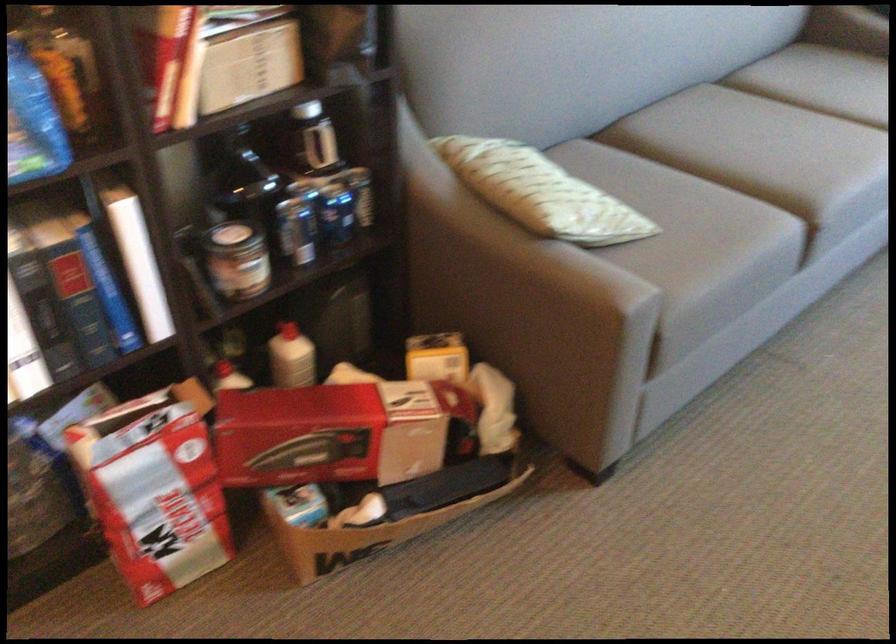
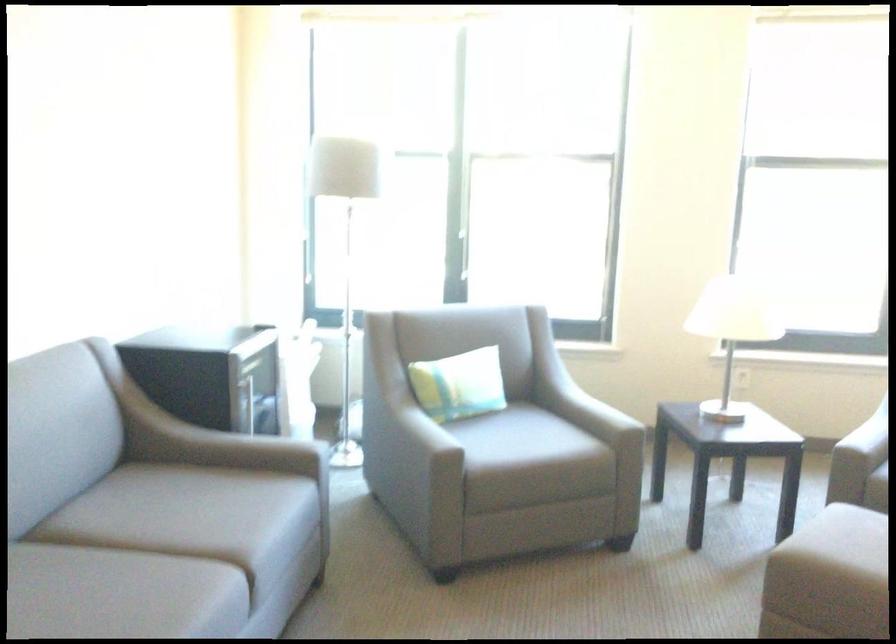
In the scene shown: How did the camera likely rotate?

The camera rotated toward right-up.